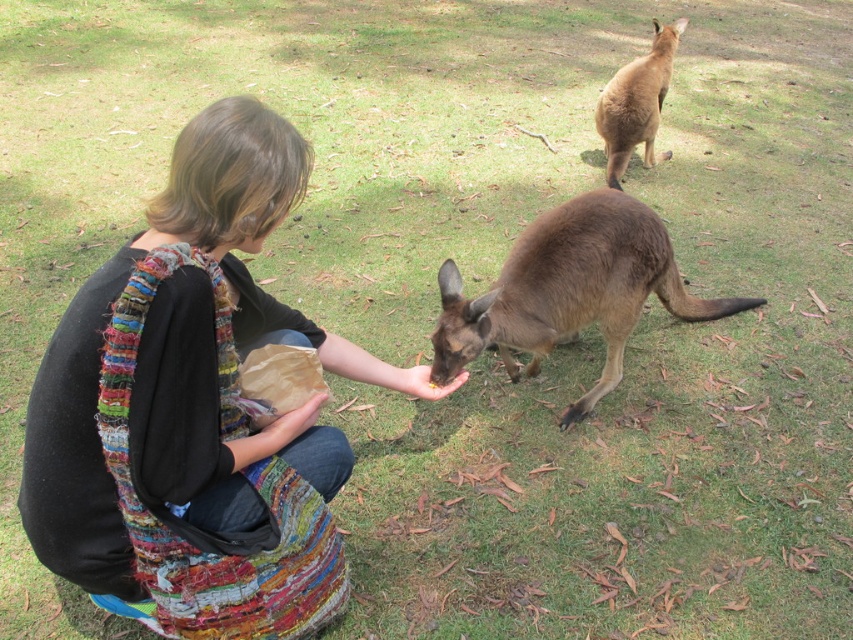
Question: Does multicolored woven vest at center appear on the right side of brown furry kangaroo at upper right?

Choices:
 (A) yes
 (B) no

Answer: (B)

Question: Is brown furry kangaroo at center to the left of brown crinkled paper bag at lower center from the viewer's perspective?

Choices:
 (A) no
 (B) yes

Answer: (A)

Question: Which point is farther to the camera?

Choices:
 (A) brown crinkled paper bag at lower center
 (B) multicolored woven vest at center

Answer: (A)

Question: Can you confirm if multicolored woven vest at center is positioned to the right of brown furry kangaroo at upper right?

Choices:
 (A) no
 (B) yes

Answer: (A)

Question: Estimate the real-world distances between objects in this image. Which object is closer to the brown crinkled paper bag at lower center?

Choices:
 (A) smooth skin hand at center
 (B) multicolored woven vest at center
 (C) brown furry kangaroo at upper right

Answer: (B)

Question: Which object is positioned closest to the multicolored woven vest at center?

Choices:
 (A) brown furry kangaroo at center
 (B) brown furry kangaroo at upper right
 (C) brown crinkled paper bag at lower center

Answer: (C)